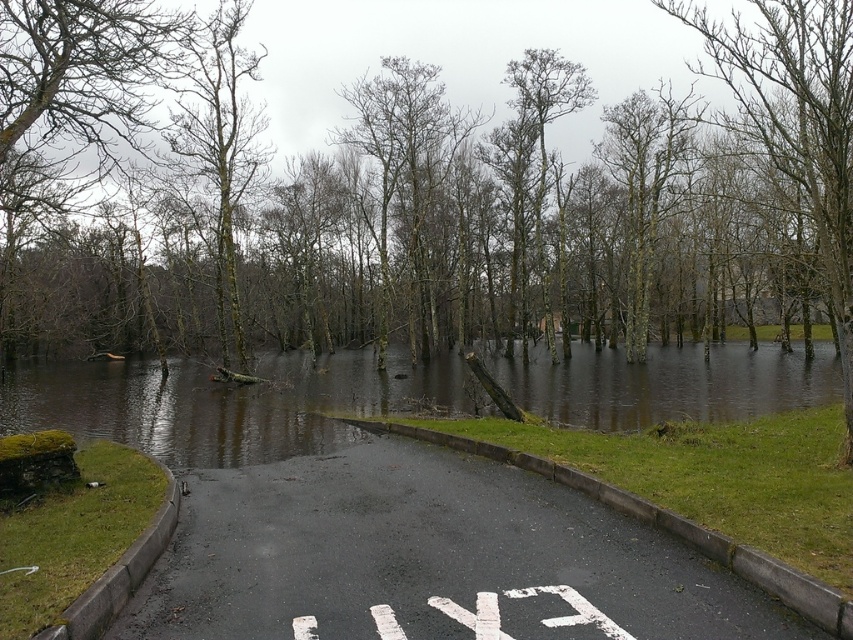
You are a park ranger assessing the flood damage. You notice the green leafless tree at center and the smooth bark tree at upper center. Based on their widths, which tree could potentially block the path if the water level rises further?

The green leafless tree at center might block the path if the water level rises further since it might be wider than the smooth bark tree at upper center.

You are a park ranger assessing the flooded area. You notice the green leafless tree at center and the bare wood tree at center. Which tree would require more space for its root system due to its size?

The green leafless tree at center is larger in size than the bare wood tree at center, so it would require more space for its root system.

From the picture: You are a hiker trying to cross the flooded area in the park. You see the green leafless tree at center and the bare wood tree at center. Which tree is closer to you?

The green leafless tree at center and the bare wood tree at center are 13.92 meters apart from each other, so you need to determine which one is closer based on their positions. However, the description only provides the distance between them, not their individual distances from you. Without additional information about their exact locations relative to your position, it is impossible to determine which tree is closer.